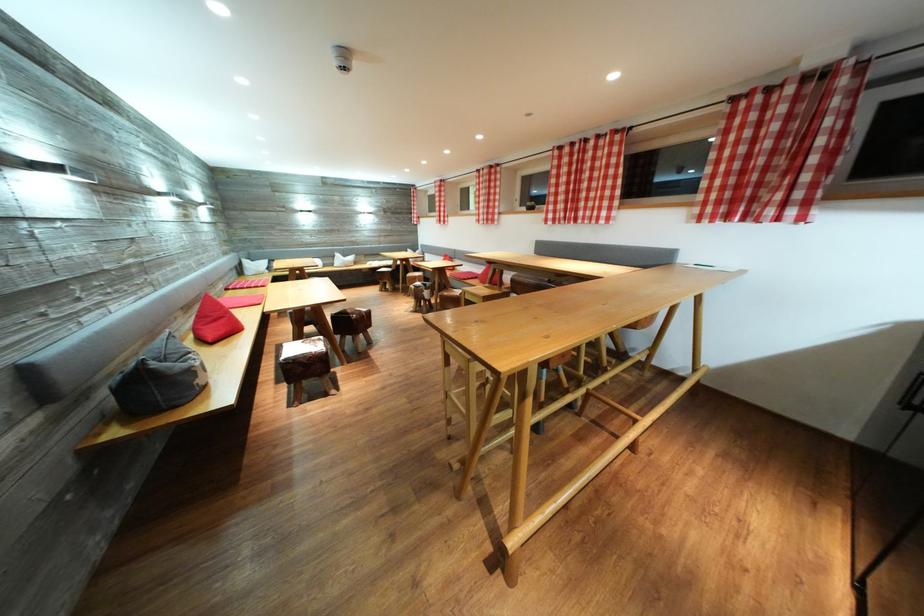
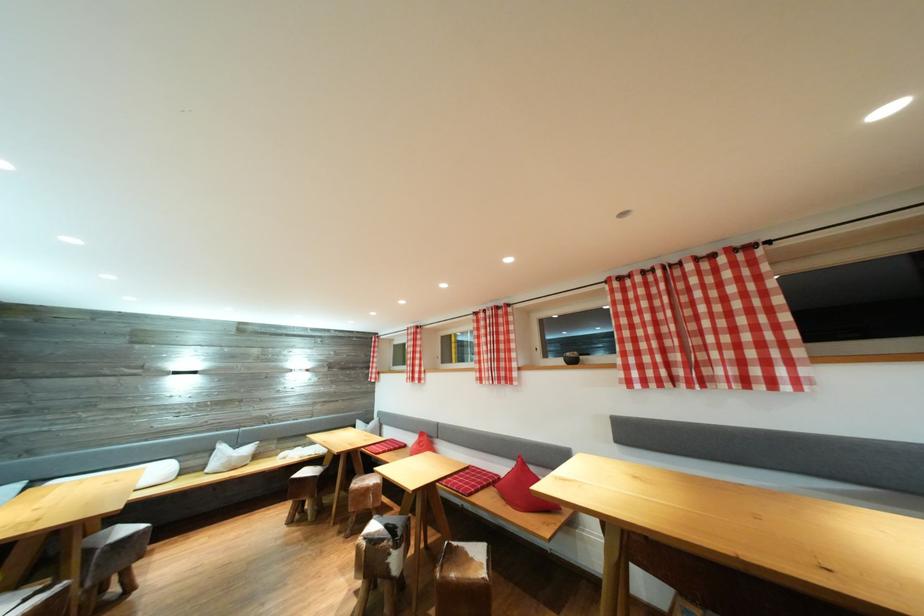
In the second image, find the point that corresponds to (x=345, y=261) in the first image.

(228, 453)